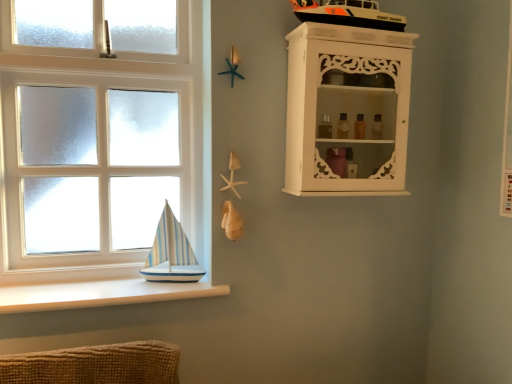
Question: Considering the relative positions of white smooth ledge at lower left and white wooden window at left in the image provided, is white smooth ledge at lower left in front of white wooden window at left?

Choices:
 (A) no
 (B) yes

Answer: (B)

Question: Considering the relative positions of white smooth ledge at lower left and white wooden window at left in the image provided, is white smooth ledge at lower left behind white wooden window at left?

Choices:
 (A) no
 (B) yes

Answer: (A)

Question: From the image's perspective, is white smooth ledge at lower left located above white wooden window at left?

Choices:
 (A) no
 (B) yes

Answer: (A)

Question: Could you tell me if white smooth ledge at lower left is turned towards white wooden window at left?

Choices:
 (A) yes
 (B) no

Answer: (B)

Question: Is white smooth ledge at lower left facing away from white wooden window at left?

Choices:
 (A) yes
 (B) no

Answer: (B)

Question: In terms of height, does white wooden window at left look taller or shorter compared to striped sailboat at window sill?

Choices:
 (A) tall
 (B) short

Answer: (A)

Question: Looking at the image, does white wooden window at left seem bigger or smaller compared to striped sailboat at window sill?

Choices:
 (A) small
 (B) big

Answer: (B)

Question: From a real-world perspective, is white wooden window at left positioned above or below striped sailboat at window sill?

Choices:
 (A) below
 (B) above

Answer: (B)

Question: From the image's perspective, is white wooden window at left located above or below striped sailboat at window sill?

Choices:
 (A) below
 (B) above

Answer: (B)

Question: Is white smooth ledge at lower left wider or thinner than white carved cabinet at upper right?

Choices:
 (A) thin
 (B) wide

Answer: (B)

Question: Considering the positions of white smooth ledge at lower left and white carved cabinet at upper right in the image, is white smooth ledge at lower left taller or shorter than white carved cabinet at upper right?

Choices:
 (A) tall
 (B) short

Answer: (B)

Question: Does point (124, 279) appear closer or farther from the camera than point (389, 120)?

Choices:
 (A) farther
 (B) closer

Answer: (B)

Question: From the image's perspective, relative to white carved cabinet at upper right, is white smooth ledge at lower left above or below?

Choices:
 (A) above
 (B) below

Answer: (B)

Question: Does point (344, 84) appear closer or farther from the camera than point (95, 64)?

Choices:
 (A) farther
 (B) closer

Answer: (B)

Question: Is white carved cabinet at upper right wider or thinner than white wooden window at left?

Choices:
 (A) thin
 (B) wide

Answer: (B)